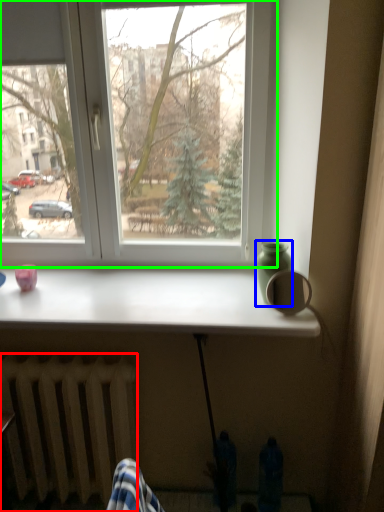
Question: Based on their relative distances, which object is nearer to radiator (highlighted by a red box)? Choose from glass vase (highlighted by a blue box) and window (highlighted by a green box).

Choices:
 (A) glass vase
 (B) window

Answer: (B)